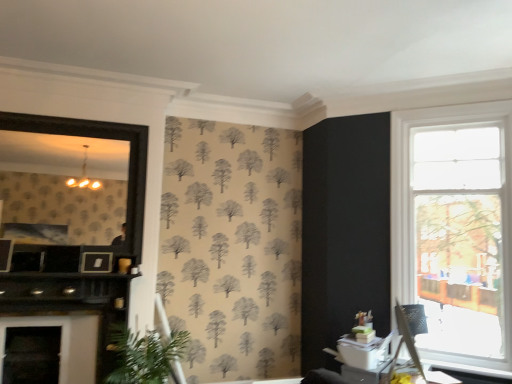
Question: From a real-world perspective, relative to black wooden frame at left, is green leafy plant at lower left vertically above or below?

Choices:
 (A) below
 (B) above

Answer: (A)

Question: Is green leafy plant at lower left taller or shorter than black wooden frame at left?

Choices:
 (A) tall
 (B) short

Answer: (B)

Question: Which is nearer to the green leafy plant at lower left?

Choices:
 (A) black wooden frame at left
 (B) white glossy table at lower right
 (C) clear glass window at right
 (D) matte black picture frame at upper left
 (E) black matte fireplace at left

Answer: (E)

Question: Estimate the real-world distances between objects in this image. Which object is closer to the black matte fireplace at left?

Choices:
 (A) clear glass window at right
 (B) white glossy table at lower right
 (C) black wooden frame at left
 (D) green leafy plant at lower left
 (E) matte black picture frame at upper left

Answer: (D)